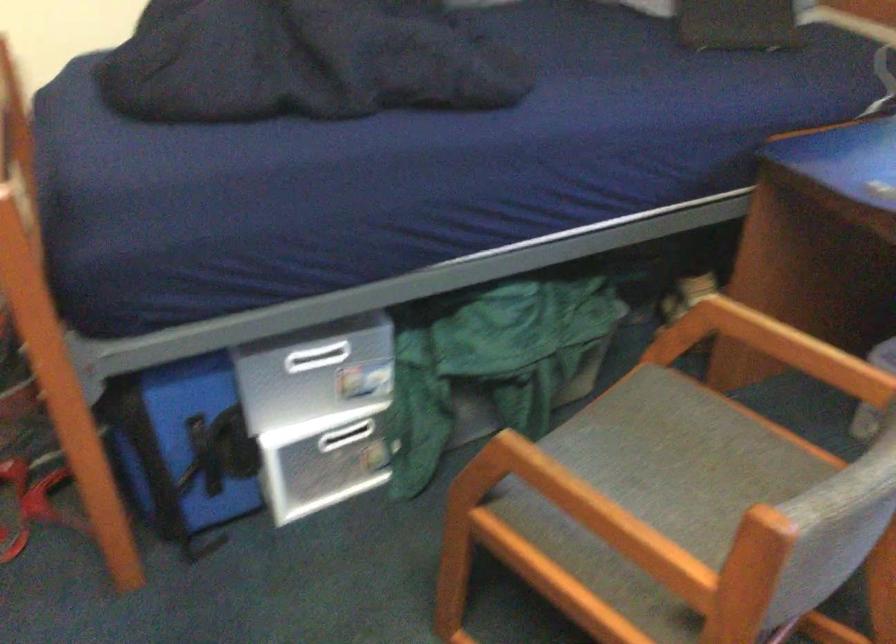
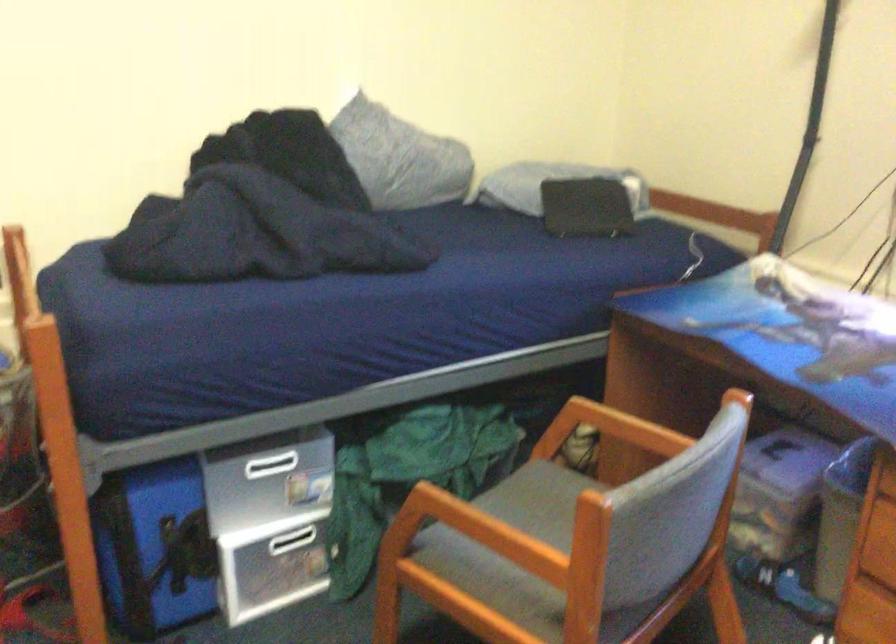
Question: In a continuous first-person perspective shot, in which direction is the camera moving?

Choices:
 (A) Left
 (B) Right
 (C) Forward
 (D) Backward

Answer: (D)